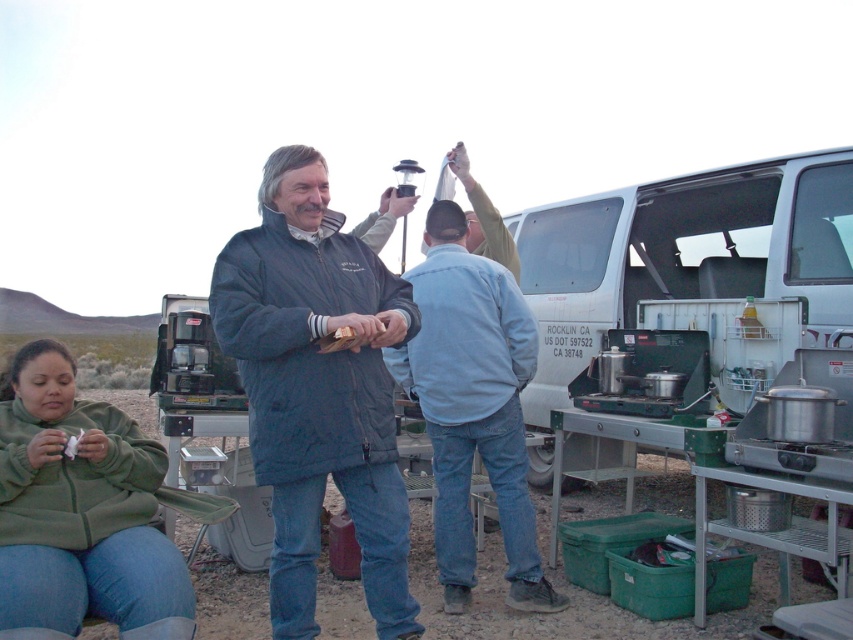
Question: Is green fleece jacket at lower left smaller than light blue denim jacket at center?

Choices:
 (A) no
 (B) yes

Answer: (A)

Question: Among these objects, which one is farthest from the camera?

Choices:
 (A) blue quilted jacket at center
 (B) white plastic van at center
 (C) green fleece jacket at lower left
 (D) light blue denim jacket at center

Answer: (B)

Question: Among these points, which one is farthest from the camera?

Choices:
 (A) (717, 259)
 (B) (288, 595)
 (C) (128, 625)

Answer: (A)

Question: Where is white plastic van at center located in relation to light blue denim jacket at center in the image?

Choices:
 (A) above
 (B) below

Answer: (A)

Question: Which object appears farthest from the camera in this image?

Choices:
 (A) white plastic van at center
 (B) light blue denim jacket at center
 (C) blue quilted jacket at center

Answer: (A)

Question: Is white plastic van at center thinner than light blue denim jacket at center?

Choices:
 (A) yes
 (B) no

Answer: (B)